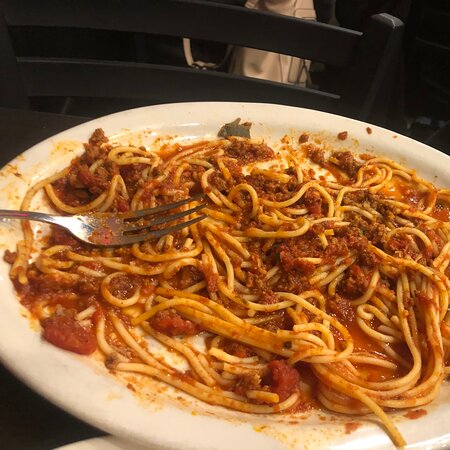
Find the location of a particular element. This screenshot has height=450, width=450. chair is located at coordinates [326, 37].